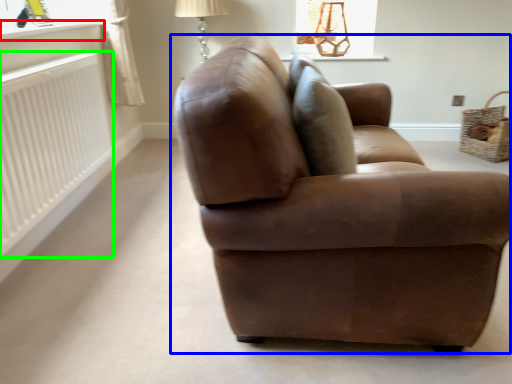
Question: Estimate the real-world distances between objects in this image. Which object is closer to window sill (highlighted by a red box), studio couch (highlighted by a blue box) or radiator (highlighted by a green box)?

Choices:
 (A) studio couch
 (B) radiator

Answer: (B)